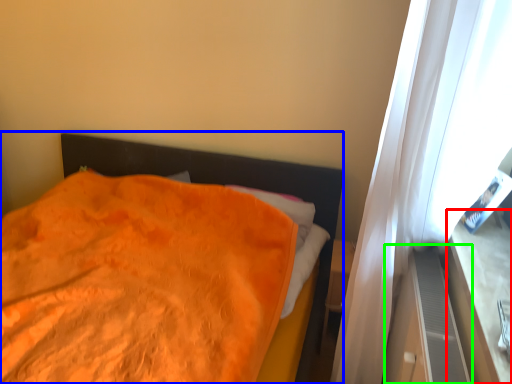
Question: Which object is positioned closest to window sill (highlighted by a red box)? Select from bed (highlighted by a blue box) and dresser (highlighted by a green box).

Choices:
 (A) bed
 (B) dresser

Answer: (B)